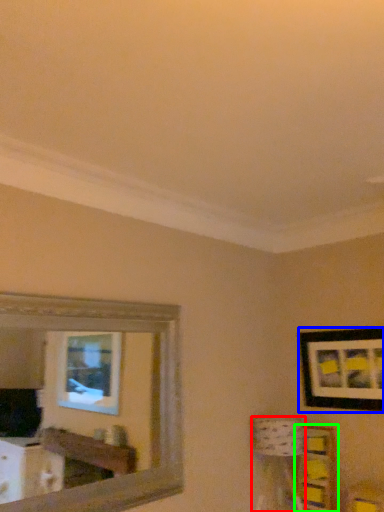
Question: Which object is the closest to the table lamp (highlighted by a red box)? Choose among these: picture frame (highlighted by a blue box) or shelf (highlighted by a green box).

Choices:
 (A) picture frame
 (B) shelf

Answer: (B)